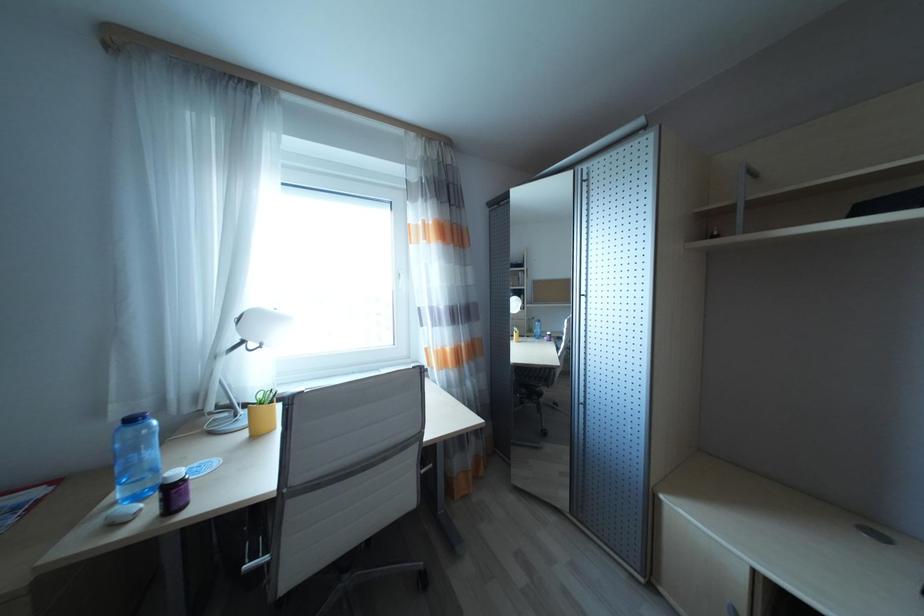
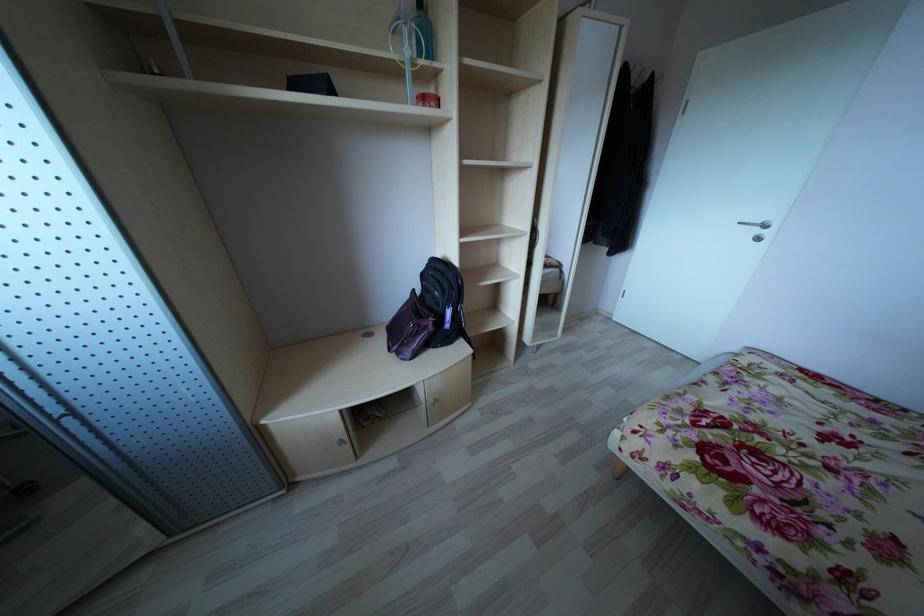
Based on the continuous images, in which direction is the camera rotating?

The rotation direction of the camera is right-down.